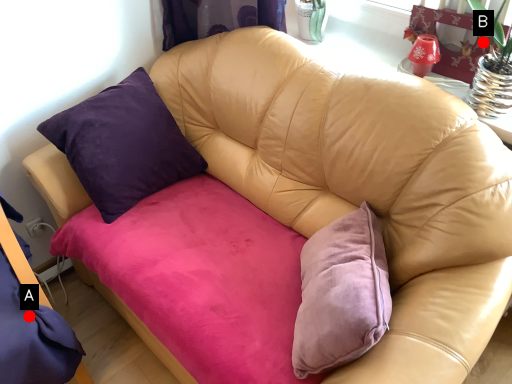
Question: Two points are circled on the image, labeled by A and B beside each circle. Which of the following is the closest to the observer?

Choices:
 (A) A is closer
 (B) B is closer

Answer: (A)